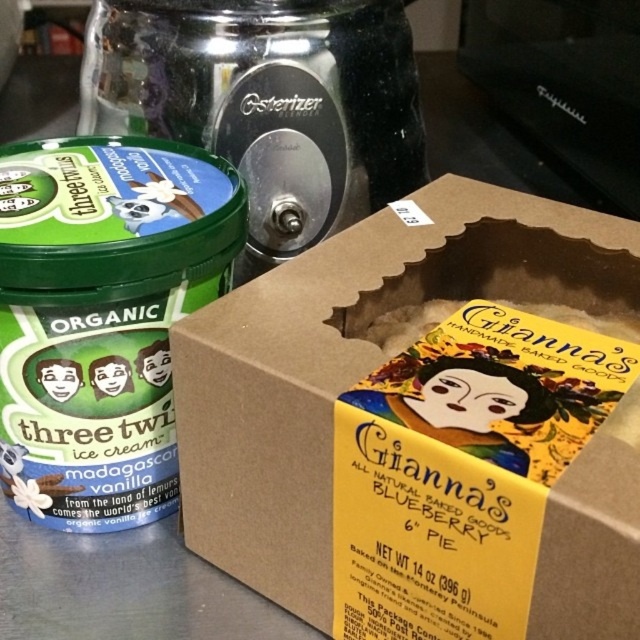
Which is above, brown cardboard box at center or green matte ice cream container at left?

green matte ice cream container at left is above.

Does brown cardboard box at center appear on the right side of green matte ice cream container at left?

Correct, you'll find brown cardboard box at center to the right of green matte ice cream container at left.

Is point (236, 396) less distant than point (172, 397)?

That is True.

The width and height of the screenshot is (640, 640). Identify the location of brown cardboard box at center. (352, 362).